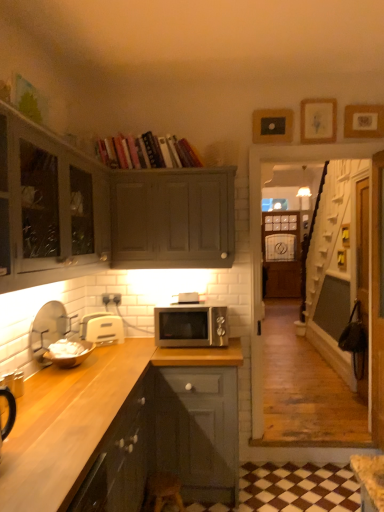
Question: From a real-world perspective, does black matte picture frame at upper center, positioned as the 1th picture frame in left-to-right order, stand above dark wood countertop at lower left, placed as the third cabinetry when sorted from top to bottom?

Choices:
 (A) no
 (B) yes

Answer: (B)

Question: From a real-world perspective, does black matte picture frame at upper center, positioned as the 1th picture frame in left-to-right order, sit lower than dark wood countertop at lower left, which is the 1th cabinetry from bottom to top?

Choices:
 (A) yes
 (B) no

Answer: (B)

Question: Does black matte picture frame at upper center, which appears as the third picture frame when viewed from the right, lie behind dark wood countertop at lower left, which is the 1th cabinetry from bottom to top?

Choices:
 (A) yes
 (B) no

Answer: (A)

Question: Is black matte picture frame at upper center, positioned as the 1th picture frame in left-to-right order, thinner than dark wood countertop at lower left, placed as the third cabinetry when sorted from top to bottom?

Choices:
 (A) no
 (B) yes

Answer: (B)

Question: Is black matte picture frame at upper center, positioned as the 1th picture frame in left-to-right order, smaller than dark wood countertop at lower left, placed as the third cabinetry when sorted from top to bottom?

Choices:
 (A) no
 (B) yes

Answer: (B)

Question: Can you confirm if black matte picture frame at upper center, positioned as the 1th picture frame in left-to-right order, is bigger than dark wood countertop at lower left, placed as the third cabinetry when sorted from top to bottom?

Choices:
 (A) no
 (B) yes

Answer: (A)

Question: Considering the relative sizes of silver metallic microwave at center, the fourth appliance in the left-to-right sequence, and white plastic toaster at lower left, which is the third appliance from left to right, in the image provided, is silver metallic microwave at center, the fourth appliance in the left-to-right sequence, bigger than white plastic toaster at lower left, which is the third appliance from left to right,?

Choices:
 (A) yes
 (B) no

Answer: (B)

Question: Could you tell me if silver metallic microwave at center, the fourth appliance in the left-to-right sequence, is facing white plastic toaster at lower left, arranged as the second appliance when viewed from the right?

Choices:
 (A) yes
 (B) no

Answer: (B)

Question: From the image's perspective, is silver metallic microwave at center, which is the first appliance from right to left, on white plastic toaster at lower left, which is the third appliance from left to right?

Choices:
 (A) no
 (B) yes

Answer: (B)

Question: Considering the relative sizes of silver metallic microwave at center, which is the first appliance from right to left, and white plastic toaster at lower left, which is the third appliance from left to right, in the image provided, is silver metallic microwave at center, which is the first appliance from right to left, thinner than white plastic toaster at lower left, which is the third appliance from left to right,?

Choices:
 (A) yes
 (B) no

Answer: (B)

Question: Is silver metallic microwave at center, the fourth appliance in the left-to-right sequence, positioned before white plastic toaster at lower left, arranged as the second appliance when viewed from the right?

Choices:
 (A) no
 (B) yes

Answer: (B)

Question: Is silver metallic microwave at center, the fourth appliance in the left-to-right sequence, positioned far away from white plastic toaster at lower left, arranged as the second appliance when viewed from the right?

Choices:
 (A) no
 (B) yes

Answer: (A)

Question: Is silver metallic microwave at center, the fourth appliance in the left-to-right sequence, to the right of wooden picture frame at upper center, which is counted as the 2th picture frame, starting from the right, from the viewer's perspective?

Choices:
 (A) yes
 (B) no

Answer: (B)